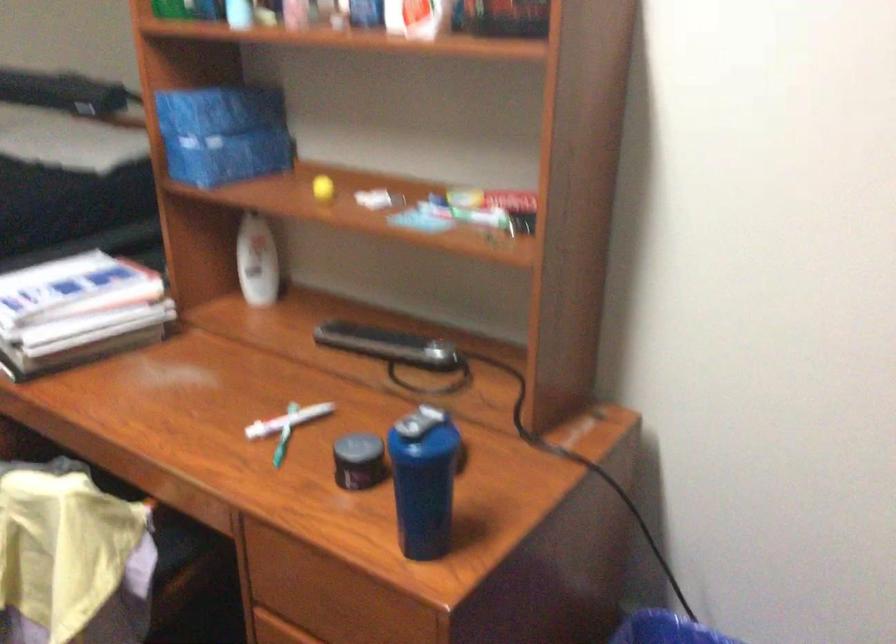
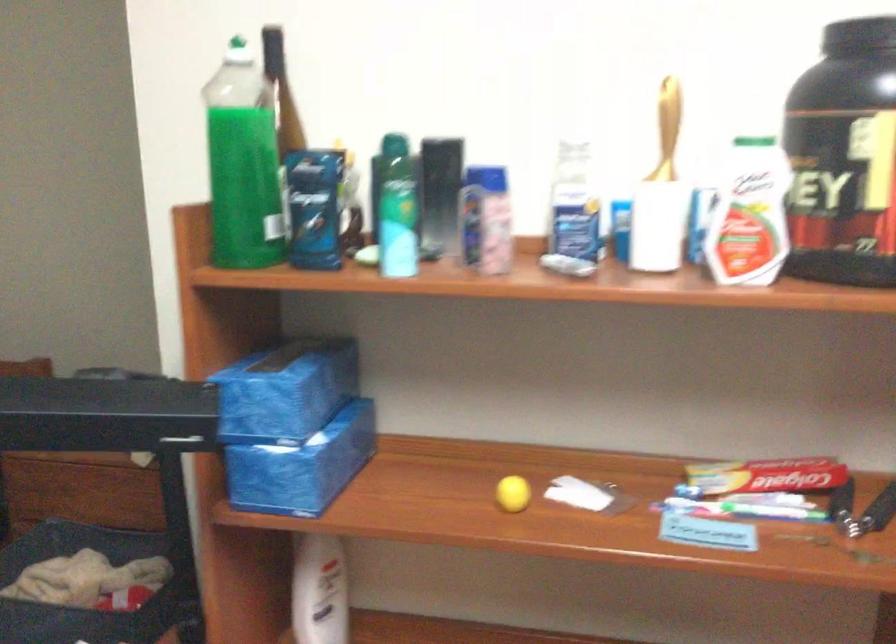
Where in the second image is the point corresponding to pixel 498 204 from the first image?

(764, 483)